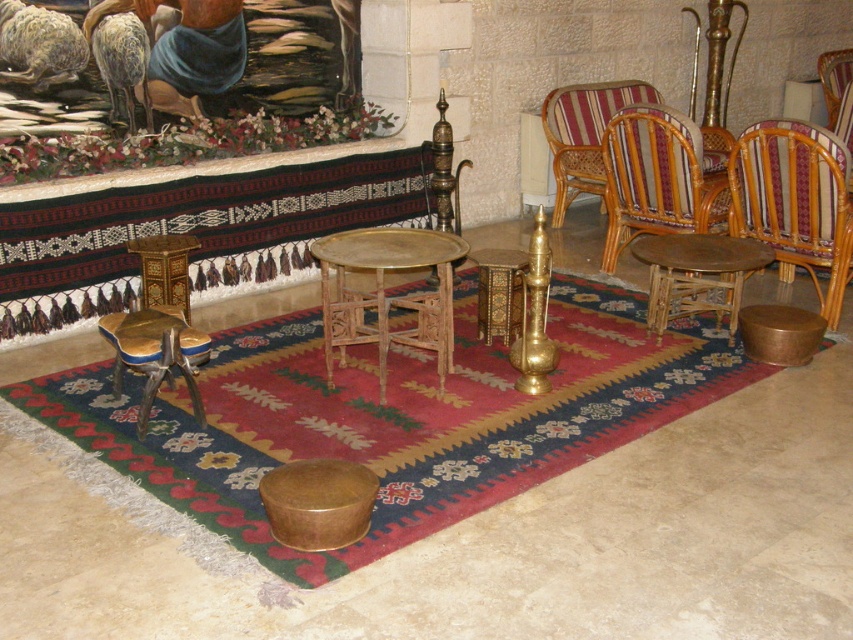
Question: Can you confirm if woven rattan armchair at right is smaller than gold-bronze table at center?

Choices:
 (A) no
 (B) yes

Answer: (B)

Question: Is gold-bronze table at center bigger than gold textured stool at center?

Choices:
 (A) no
 (B) yes

Answer: (B)

Question: Which point is closer to the camera taking this photo?

Choices:
 (A) pyautogui.click(x=479, y=300)
 (B) pyautogui.click(x=358, y=260)

Answer: (B)

Question: Considering the real-world distances, which object is farthest from the gold textured stool at center?

Choices:
 (A) woven rattan armchair at right
 (B) wooden table at center
 (C) rattan armchair at center
 (D) striped fabric armchair at center

Answer: (D)

Question: Considering the real-world distances, which object is closest to the wooden table at center?

Choices:
 (A) rattan armchair at center
 (B) gold textured stool at center
 (C) woven rattan armchair at right
 (D) striped fabric armchair at center

Answer: (C)

Question: Can you confirm if woven rattan armchair at right is smaller than gold polished stool at lower left?

Choices:
 (A) yes
 (B) no

Answer: (B)